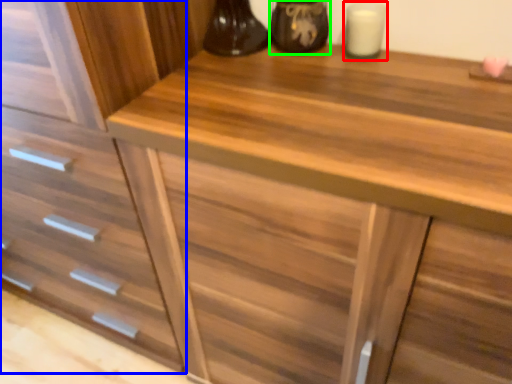
Question: Based on their relative distances, which object is nearer to candle holder (highlighted by a red box)? Choose from drawer (highlighted by a blue box) and appliance (highlighted by a green box).

Choices:
 (A) drawer
 (B) appliance

Answer: (B)